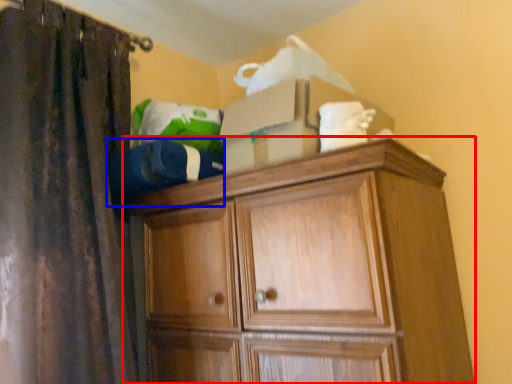
Question: Which object is closer to the camera taking this photo, cupboard (highlighted by a red box) or clothing (highlighted by a blue box)?

Choices:
 (A) cupboard
 (B) clothing

Answer: (A)